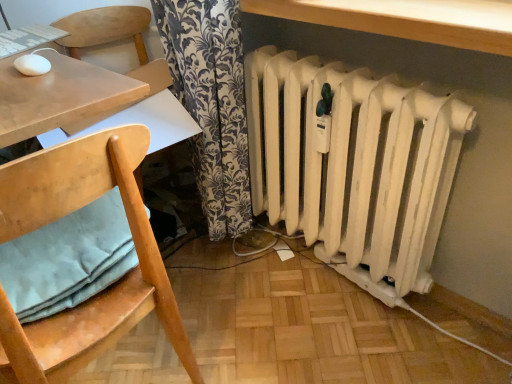
Question: Is wooden table at upper center at the left side of wooden chair with cushion at left?

Choices:
 (A) no
 (B) yes

Answer: (A)

Question: From the image's perspective, is wooden table at upper center located above wooden chair with cushion at left?

Choices:
 (A) no
 (B) yes

Answer: (B)

Question: Considering the relative sizes of wooden table at upper center and wooden chair with cushion at left in the image provided, is wooden table at upper center shorter than wooden chair with cushion at left?

Choices:
 (A) no
 (B) yes

Answer: (B)

Question: Does wooden table at upper center have a greater width compared to wooden chair with cushion at left?

Choices:
 (A) yes
 (B) no

Answer: (B)

Question: From a real-world perspective, does wooden table at upper center stand above wooden chair with cushion at left?

Choices:
 (A) yes
 (B) no

Answer: (A)

Question: Considering the positions of point click(82, 220) and point click(360, 140), is point click(82, 220) closer or farther from the camera than point click(360, 140)?

Choices:
 (A) farther
 (B) closer

Answer: (B)

Question: Do you think light blue fabric pillow at lower left is within white matte radiator at lower right, or outside of it?

Choices:
 (A) outside
 (B) inside

Answer: (A)

Question: In terms of width, does light blue fabric pillow at lower left look wider or thinner when compared to white matte radiator at lower right?

Choices:
 (A) thin
 (B) wide

Answer: (B)

Question: From the image's perspective, relative to white matte radiator at lower right, is light blue fabric pillow at lower left above or below?

Choices:
 (A) above
 (B) below

Answer: (B)

Question: Is wooden chair with cushion at left spatially inside wooden table at upper center, or outside of it?

Choices:
 (A) outside
 (B) inside

Answer: (A)

Question: From the image's perspective, is wooden chair with cushion at left positioned above or below wooden table at upper center?

Choices:
 (A) above
 (B) below

Answer: (B)

Question: Looking at their shapes, would you say wooden chair with cushion at left is wider or thinner than wooden table at upper center?

Choices:
 (A) wide
 (B) thin

Answer: (A)

Question: In terms of size, does wooden chair with cushion at left appear bigger or smaller than wooden table at upper center?

Choices:
 (A) small
 (B) big

Answer: (B)

Question: Considering their positions, is white matte radiator at lower right located in front of or behind light blue fabric pillow at lower left?

Choices:
 (A) front
 (B) behind

Answer: (B)

Question: Is white matte radiator at lower right bigger or smaller than light blue fabric pillow at lower left?

Choices:
 (A) big
 (B) small

Answer: (A)